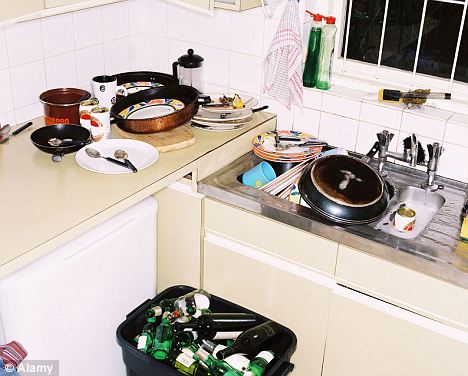
Where is `sink`? Image resolution: width=468 pixels, height=376 pixels. sink is located at coordinates (425, 246), (282, 153).